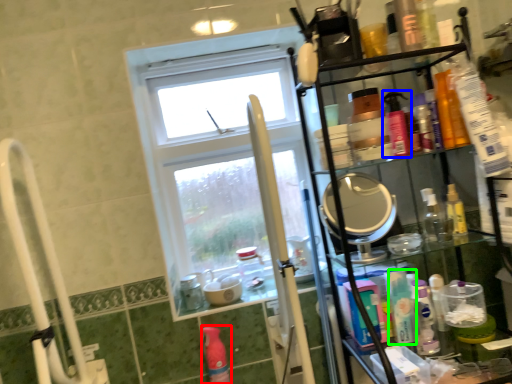
Question: Considering the real-world distances, which object is closest to cleaning product (highlighted by a red box)? mouthwash (highlighted by a blue box) or mouthwash (highlighted by a green box).

Choices:
 (A) mouthwash
 (B) mouthwash

Answer: (B)